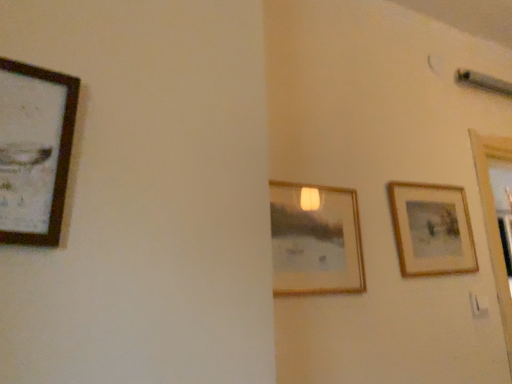
Question: Is wooden framed artwork at left, acting as the 1th picture frame starting from the left, not near wooden framed picture at center, acting as the second picture frame starting from the left?

Choices:
 (A) no
 (B) yes

Answer: (A)

Question: Is wooden framed artwork at left, acting as the 1th picture frame starting from the front, positioned with its back to wooden framed picture at center, positioned as the second picture frame in back-to-front order?

Choices:
 (A) yes
 (B) no

Answer: (B)

Question: Can wooden framed picture at center, positioned as the second picture frame in back-to-front order, be found inside wooden framed artwork at left, the 3th picture frame viewed from the back?

Choices:
 (A) no
 (B) yes

Answer: (A)

Question: Is wooden framed artwork at left, the 3th picture frame viewed from the back, with wooden framed picture at center, arranged as the second picture frame when viewed from the front?

Choices:
 (A) yes
 (B) no

Answer: (B)

Question: Considering the relative positions of wooden framed artwork at left, acting as the 1th picture frame starting from the left, and wooden framed picture at center, arranged as the 2th picture frame when viewed from the right, in the image provided, is wooden framed artwork at left, acting as the 1th picture frame starting from the left, in front of wooden framed picture at center, arranged as the 2th picture frame when viewed from the right,?

Choices:
 (A) no
 (B) yes

Answer: (B)

Question: From a real-world perspective, is wooden framed picture at center, arranged as the second picture frame when viewed from the front, above or below wooden framed picture at right, positioned as the third picture frame in left-to-right order?

Choices:
 (A) above
 (B) below

Answer: (B)

Question: In terms of width, does wooden framed picture at center, arranged as the 2th picture frame when viewed from the right, look wider or thinner when compared to wooden framed picture at right, acting as the 1th picture frame starting from the back?

Choices:
 (A) thin
 (B) wide

Answer: (B)

Question: From the image's perspective, relative to wooden framed picture at right, positioned as the 3th picture frame in front-to-back order, is wooden framed picture at center, arranged as the second picture frame when viewed from the front, above or below?

Choices:
 (A) below
 (B) above

Answer: (A)

Question: Is wooden framed picture at center, acting as the second picture frame starting from the left, in front of or behind wooden framed picture at right, which appears as the first picture frame when viewed from the right, in the image?

Choices:
 (A) behind
 (B) front

Answer: (B)

Question: From a real-world perspective, is wooden framed picture at right, positioned as the third picture frame in left-to-right order, above or below wooden framed artwork at left, which is counted as the 3th picture frame, starting from the right?

Choices:
 (A) below
 (B) above

Answer: (A)

Question: Is point pos(463,193) closer or farther from the camera than point pos(62,112)?

Choices:
 (A) farther
 (B) closer

Answer: (A)

Question: From the image's perspective, is wooden framed picture at right, acting as the 1th picture frame starting from the back, above or below wooden framed artwork at left, acting as the 1th picture frame starting from the front?

Choices:
 (A) below
 (B) above

Answer: (A)

Question: Considering the positions of wooden framed picture at right, acting as the 1th picture frame starting from the back, and wooden framed artwork at left, acting as the 1th picture frame starting from the left, in the image, is wooden framed picture at right, acting as the 1th picture frame starting from the back, taller or shorter than wooden framed artwork at left, acting as the 1th picture frame starting from the left,?

Choices:
 (A) short
 (B) tall

Answer: (B)

Question: Visually, is wooden framed artwork at left, the 3th picture frame viewed from the back, positioned to the left or to the right of wooden framed picture at right, positioned as the third picture frame in left-to-right order?

Choices:
 (A) left
 (B) right

Answer: (A)

Question: From their relative heights in the image, would you say wooden framed artwork at left, acting as the 1th picture frame starting from the front, is taller or shorter than wooden framed picture at right, which appears as the first picture frame when viewed from the right?

Choices:
 (A) short
 (B) tall

Answer: (A)